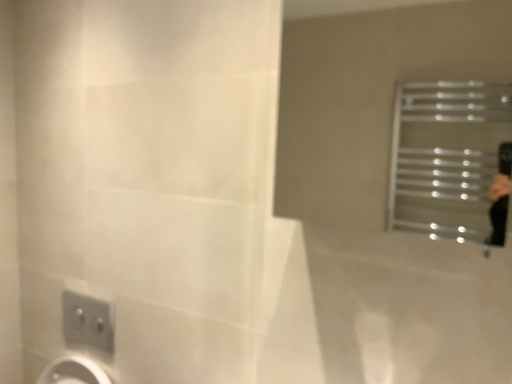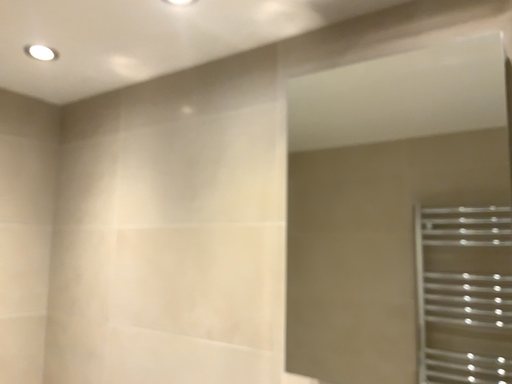
Question: How did the camera likely rotate when shooting the video?

Choices:
 (A) rotated downward
 (B) rotated upward

Answer: (B)